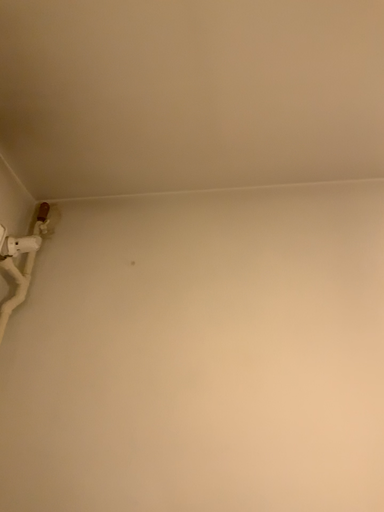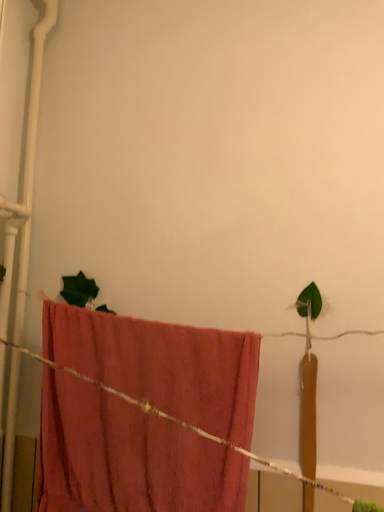
Question: How did the camera likely rotate when shooting the video?

Choices:
 (A) rotated upward
 (B) rotated downward

Answer: (B)